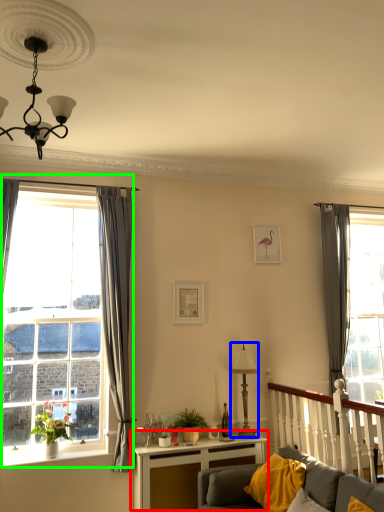
Question: Estimate the real-world distances between objects in this image. Which object is farther from table (highlighted by a red box), lamp (highlighted by a blue box) or window (highlighted by a green box)?

Choices:
 (A) lamp
 (B) window

Answer: (B)